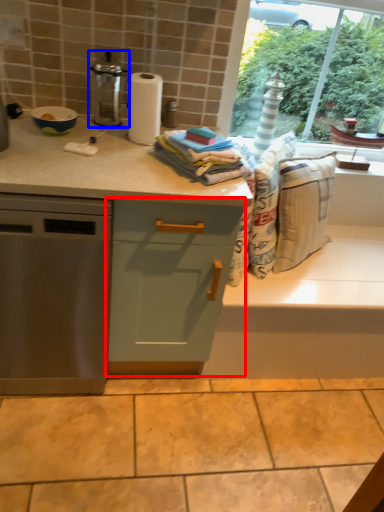
Question: Which object appears closest to the camera in this image, cabinetry (highlighted by a red box) or kitchen appliance (highlighted by a blue box)?

Choices:
 (A) cabinetry
 (B) kitchen appliance

Answer: (A)